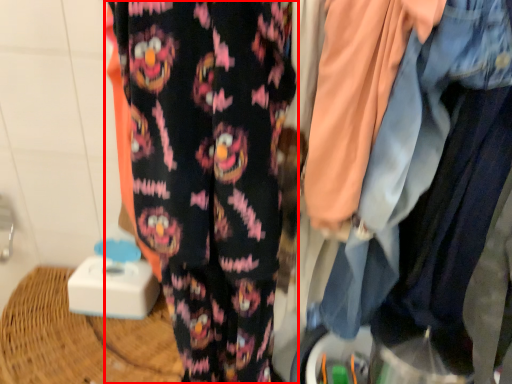
Question: In this image, where is trousers (annotated by the red box) located relative to denim jacket?

Choices:
 (A) right
 (B) left

Answer: (B)